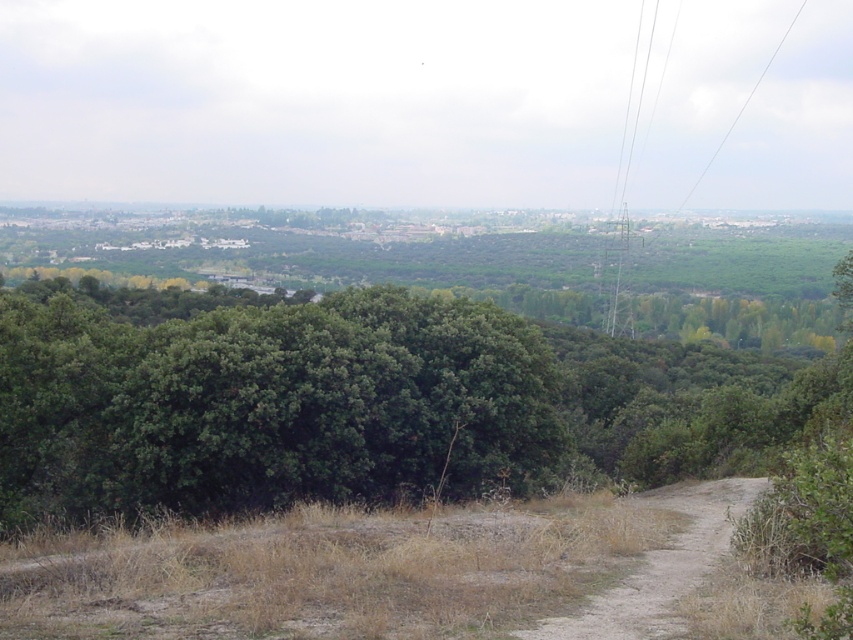
Can you confirm if dirt path at lower right is positioned below metallic wire at right?

Correct, dirt path at lower right is located below metallic wire at right.

Which is below, dirt path at lower right or metallic wire at right?

dirt path at lower right is below.

Which is behind, point (611, 620) or point (624, 296)?

Positioned behind is point (624, 296).

Locate an element on the screen. Image resolution: width=853 pixels, height=640 pixels. dirt path at lower right is located at coordinates point(660,566).

Who is lower down, green leafy tree at center or dirt path at lower right?

dirt path at lower right

Can you confirm if green leafy tree at center is wider than dirt path at lower right?

Yes.

Between point (605, 401) and point (651, 493), which one is positioned behind?

Positioned behind is point (605, 401).

Image resolution: width=853 pixels, height=640 pixels. I want to click on green leafy tree at center, so click(x=358, y=403).

Who is taller, green leafy tree at center or metallic wire at right?

metallic wire at right

Is point (68, 497) closer to camera compared to point (618, 180)?

Yes, point (68, 497) is closer to viewer.

At what (x,y) coordinates should I click in order to perform the action: click on green leafy tree at center. Please return your answer as a coordinate pair (x, y). Looking at the image, I should click on point(358,403).

The height and width of the screenshot is (640, 853). In order to click on green leafy tree at center in this screenshot , I will do `click(358, 403)`.